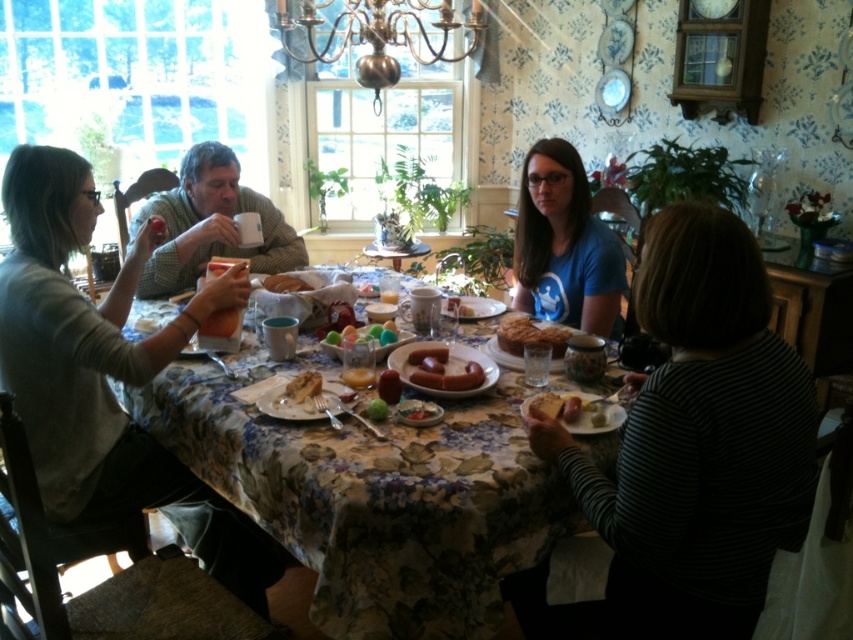
Is floral-patterned tablecloth at center below matte ceramic plate at center?

Indeed, floral-patterned tablecloth at center is positioned under matte ceramic plate at center.

Is point (177, 374) closer to viewer compared to point (456, 298)?

That is True.

Find the location of a particular element. The width and height of the screenshot is (853, 640). floral-patterned tablecloth at center is located at coordinates (376, 500).

Which is below, slightly browned sausage at center or matte brown bread at center?

slightly browned sausage at center

Who is shorter, slightly browned sausage at center or matte brown bread at center?

matte brown bread at center is shorter.

Which is in front, point (428, 369) or point (270, 280)?

Positioned in front is point (428, 369).

In order to click on slightly browned sausage at center in this screenshot , I will do `click(442, 372)`.

How far apart are blue cotton shirt at center and matte plastic eggs at center?

blue cotton shirt at center is 72.78 centimeters from matte plastic eggs at center.

Looking at this image, which is below, blue cotton shirt at center or matte plastic eggs at center?

matte plastic eggs at center is below.

Which is in front, point (544, 195) or point (335, 342)?

Positioned in front is point (335, 342).

Where is `blue cotton shirt at center`? This screenshot has width=853, height=640. blue cotton shirt at center is located at coordinates (564, 244).